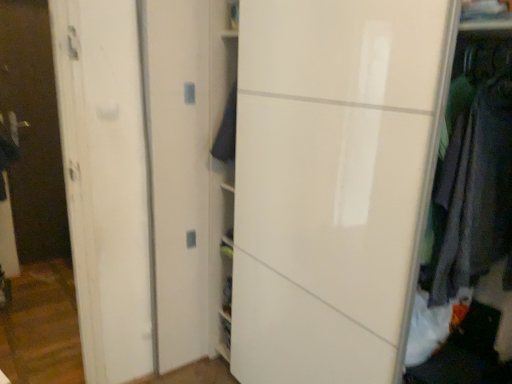
Question: From the image's perspective, is dark blue fabric at center, which is the 1th clothing from back to front, on dark gray fabric at right, marked as the 1th clothing in a right-to-left arrangement?

Choices:
 (A) no
 (B) yes

Answer: (B)

Question: Can you confirm if dark blue fabric at center, which is the 1th clothing from back to front, is positioned to the left of dark gray fabric at right, marked as the 1th clothing in a right-to-left arrangement?

Choices:
 (A) yes
 (B) no

Answer: (A)

Question: Is dark blue fabric at center, the second clothing viewed from the right, looking in the opposite direction of dark gray fabric at right, which appears as the 1th clothing when viewed from the front?

Choices:
 (A) no
 (B) yes

Answer: (A)

Question: Does dark blue fabric at center, which ranks as the 1th clothing in left-to-right order, appear on the right side of dark gray fabric at right, which is the 2th clothing from left to right?

Choices:
 (A) yes
 (B) no

Answer: (B)

Question: Is dark blue fabric at center, which ranks as the 1th clothing in left-to-right order, taller than dark gray fabric at right, marked as the 1th clothing in a right-to-left arrangement?

Choices:
 (A) yes
 (B) no

Answer: (B)

Question: Is dark gray fabric at right, which appears as the 2th clothing when viewed from the back, inside dark blue fabric at center, which ranks as the 1th clothing in left-to-right order?

Choices:
 (A) no
 (B) yes

Answer: (A)

Question: Can you confirm if transparent glass door at left is positioned to the right of dark gray fabric at right, which appears as the 1th clothing when viewed from the front?

Choices:
 (A) no
 (B) yes

Answer: (A)

Question: Considering the relative sizes of transparent glass door at left and dark gray fabric at right, which appears as the 2th clothing when viewed from the back, in the image provided, is transparent glass door at left thinner than dark gray fabric at right, which appears as the 2th clothing when viewed from the back,?

Choices:
 (A) yes
 (B) no

Answer: (A)

Question: Considering the relative sizes of transparent glass door at left and dark gray fabric at right, which appears as the 2th clothing when viewed from the back, in the image provided, is transparent glass door at left shorter than dark gray fabric at right, which appears as the 2th clothing when viewed from the back,?

Choices:
 (A) no
 (B) yes

Answer: (A)

Question: From the image's perspective, would you say transparent glass door at left is shown under dark gray fabric at right, which is the 2th clothing from left to right?

Choices:
 (A) no
 (B) yes

Answer: (A)

Question: Would you consider transparent glass door at left to be distant from dark gray fabric at right, which is the 2th clothing from left to right?

Choices:
 (A) no
 (B) yes

Answer: (B)

Question: Does transparent glass door at left lie behind dark gray fabric at right, which is the 2th clothing from left to right?

Choices:
 (A) no
 (B) yes

Answer: (B)

Question: Considering the relative sizes of dark gray fabric at right, which is the 2th clothing from left to right, and dark blue fabric at center, the second clothing when ordered from front to back, in the image provided, is dark gray fabric at right, which is the 2th clothing from left to right, taller than dark blue fabric at center, the second clothing when ordered from front to back,?

Choices:
 (A) yes
 (B) no

Answer: (A)